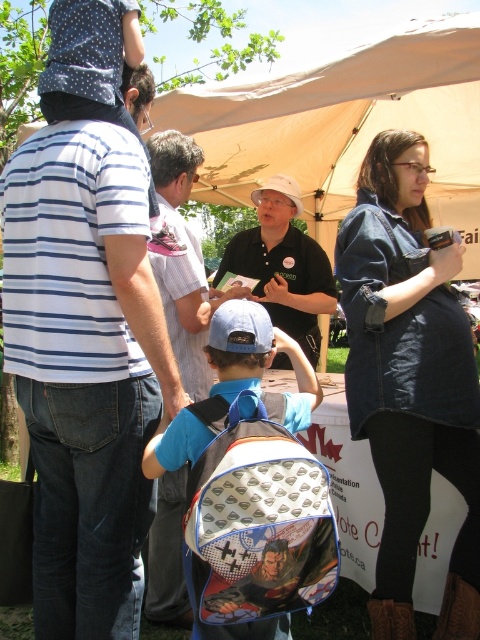
Can you confirm if denim jacket at upper right is wider than beige canvas tent at center?

No, denim jacket at upper right is not wider than beige canvas tent at center.

Looking at this image, who is positioned more to the left, denim jacket at upper right or beige canvas tent at center?

Positioned to the left is denim jacket at upper right.

Between point (462, 246) and point (465, 61), which one is positioned behind?

The point (462, 246) is behind.

At what (x,y) coordinates should I click in order to perform the action: click on denim jacket at upper right. Please return your answer as a coordinate pair (x, y). This screenshot has width=480, height=640. Looking at the image, I should click on (409, 380).

Between point (424, 45) and point (155, 548), which one is positioned in front?

Point (424, 45)

Image resolution: width=480 pixels, height=640 pixels. What are the coordinates of `beige canvas tent at center` in the screenshot? It's located at (346, 125).

Who is more forward, (244,131) or (154,180)?

Point (154,180) is more forward.

Where is `beige canvas tent at center`? beige canvas tent at center is located at coordinates (346, 125).

Based on the photo, can you confirm if denim jacket at upper right is positioned to the left of blue fabric backpack at center?

Answer: Incorrect, denim jacket at upper right is not on the left side of blue fabric backpack at center.

Is point (395, 136) positioned behind point (166, 212)?

No, (395, 136) is in front of (166, 212).

Is point (362, 298) positioned in front of point (204, 381)?

Yes, it is in front of point (204, 381).

What are the coordinates of `denim jacket at upper right` in the screenshot? It's located at (409, 380).